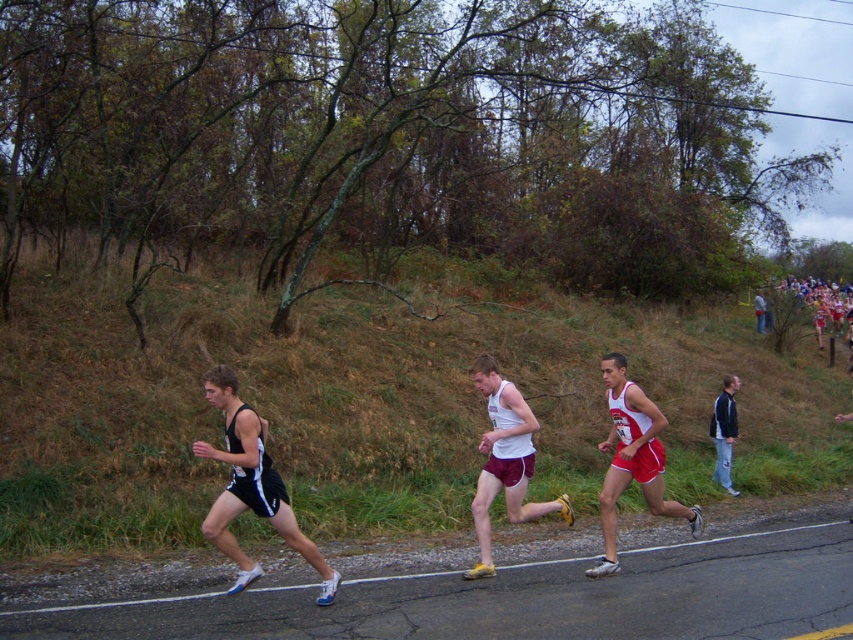
Question: Does black mesh tank top at left appear on the right side of white matte tank top at center?

Choices:
 (A) yes
 (B) no

Answer: (B)

Question: Does white matte tank top at center appear on the left side of blue fabric jacket at right?

Choices:
 (A) no
 (B) yes

Answer: (B)

Question: Which is nearer to the white matte tank top at center?

Choices:
 (A) black mesh tank top at left
 (B) white jersey at center
 (C) blue fabric jacket at right

Answer: (B)

Question: Which point appears farthest from the camera in this image?

Choices:
 (A) (764, 321)
 (B) (601, 513)
 (C) (521, 444)
 (D) (247, 506)

Answer: (A)

Question: Which point appears farthest from the camera in this image?

Choices:
 (A) (633, 456)
 (B) (735, 381)
 (C) (231, 404)
 (D) (753, 312)

Answer: (D)

Question: Can you confirm if white jersey at center is positioned to the left of red fabric jacket at right?

Choices:
 (A) no
 (B) yes

Answer: (B)